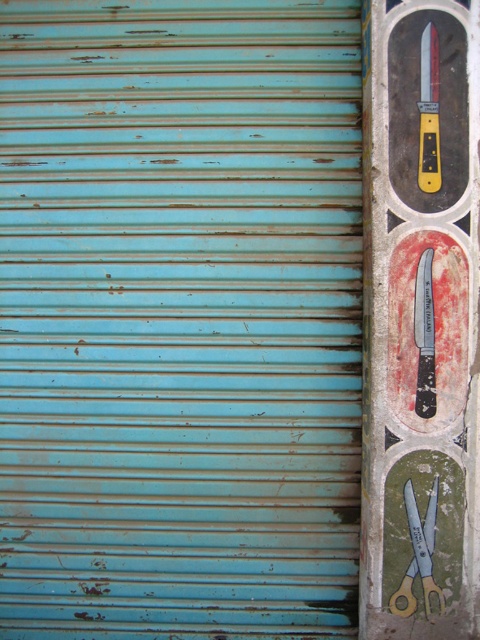
You are standing in front of a weathered blue metal shutter with some rust and chipped paint. On the right side, there are three circular designs painted with tools. Where exactly is the blue metallic scissors at right located on the shutter?

The blue metallic scissors at right is located at point [419,554] on the shutter.

Where is the painted wood knife at right located in the image?

The painted wood knife at right is located at point [420,321] in the image.

You are standing in front of a weathered light blue corrugated metal shutter with three circular tool designs on the right side. You notice a point marked at coordinates (419, 554). What object is located at that specific coordinate?

The point at coordinates (419, 554) indicates the location of the blue metallic scissors at right.